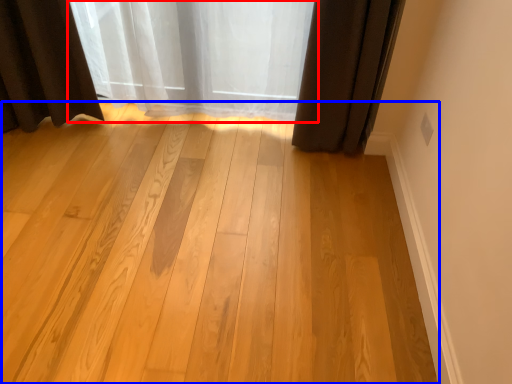
Question: Which object appears closest to the camera in this image, curtain (highlighted by a red box) or plank (highlighted by a blue box)?

Choices:
 (A) curtain
 (B) plank

Answer: (B)